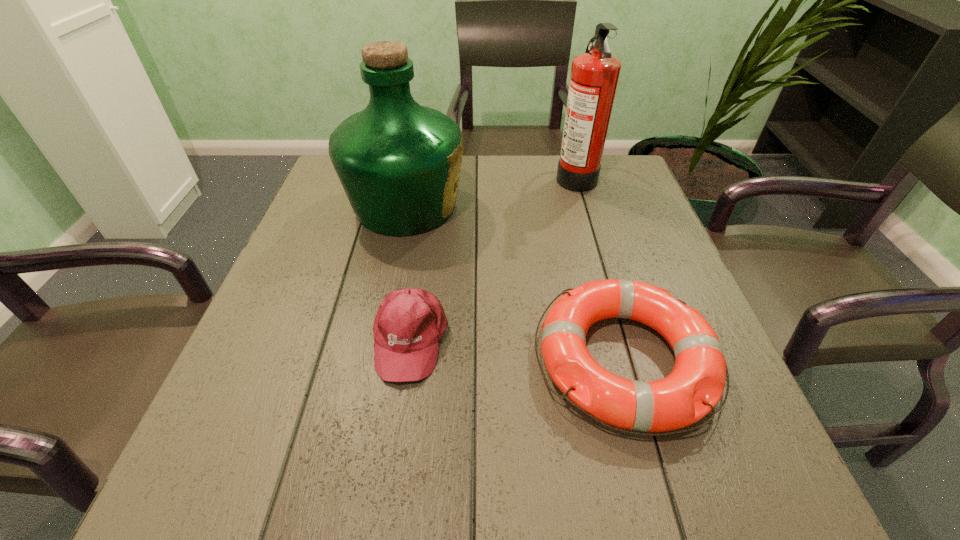
Image resolution: width=960 pixels, height=540 pixels. I want to click on fire extinguisher located at the far edge, so click(594, 76).

Where is `liquor positioned at the far edge`? liquor positioned at the far edge is located at coordinates (399, 163).

Locate an element on the screen. The width and height of the screenshot is (960, 540). object located in the left edge section of the desktop is located at coordinates (399, 163).

The height and width of the screenshot is (540, 960). I want to click on fire extinguisher that is positioned at the right edge, so click(x=594, y=76).

I want to click on life buoy that is at the right edge, so click(695, 385).

The width and height of the screenshot is (960, 540). I want to click on object that is at the far left corner, so click(399, 163).

Where is `object that is at the far right corner`? object that is at the far right corner is located at coordinates (594, 76).

Where is `blank area at the far edge`? This screenshot has width=960, height=540. blank area at the far edge is located at coordinates (532, 199).

Where is `blank area at the left edge`? This screenshot has width=960, height=540. blank area at the left edge is located at coordinates (334, 350).

This screenshot has height=540, width=960. Find the location of `vacant space at the right edge of the desktop`. vacant space at the right edge of the desktop is located at coordinates (638, 354).